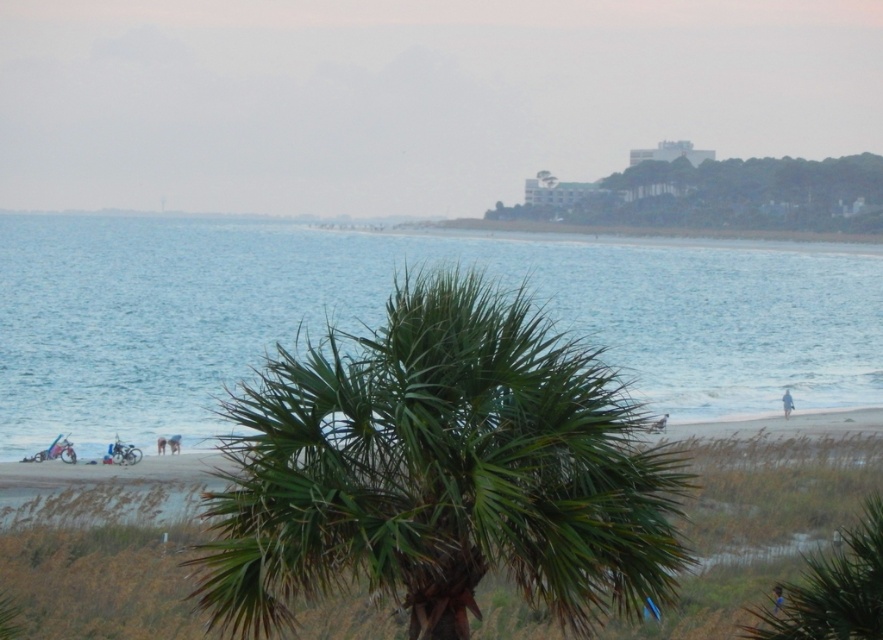
Question: Does brown sand at lower left appear under light blue fabric at lower left?

Choices:
 (A) no
 (B) yes

Answer: (B)

Question: Which of the following is the farthest from the observer?

Choices:
 (A) pos(634,276)
 (B) pos(170,444)

Answer: (A)

Question: Is green leafy palm tree at upper right positioned in front of light blue fabric at lower right?

Choices:
 (A) yes
 (B) no

Answer: (B)

Question: Which object appears closest to the camera in this image?

Choices:
 (A) blue fabric person at center
 (B) light blue fabric at lower left
 (C) brown sand at lower left
 (D) green leafy palm tree at upper right

Answer: (A)

Question: Can you confirm if brown sand at lower left is bigger than green leafy palm tree at upper right?

Choices:
 (A) yes
 (B) no

Answer: (B)

Question: Among these objects, which one is nearest to the camera?

Choices:
 (A) brown sand at lower left
 (B) green leafy palm tree at upper right
 (C) blue fabric person at center

Answer: (C)